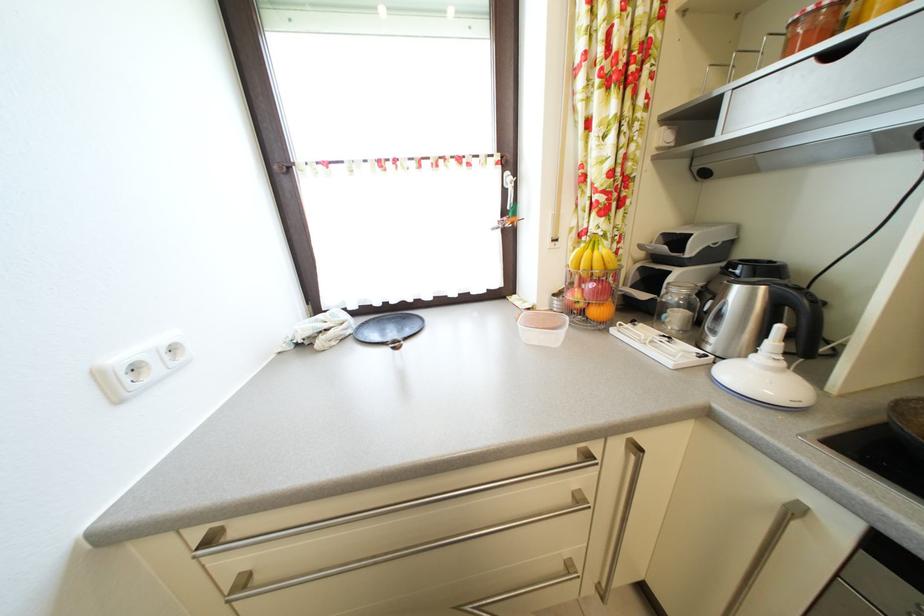
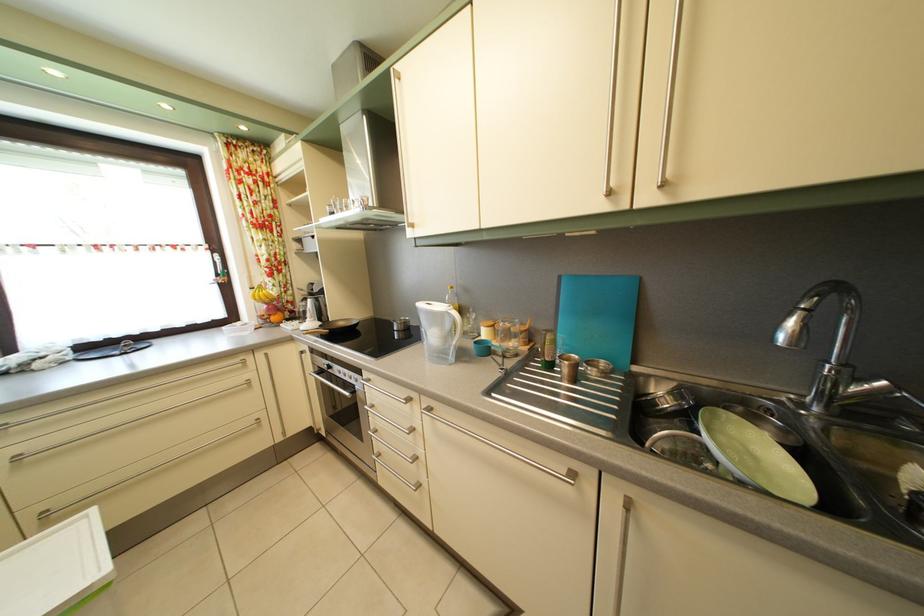
The point at (394,312) is marked in the first image. Where is the corresponding point in the second image?

(116, 347)